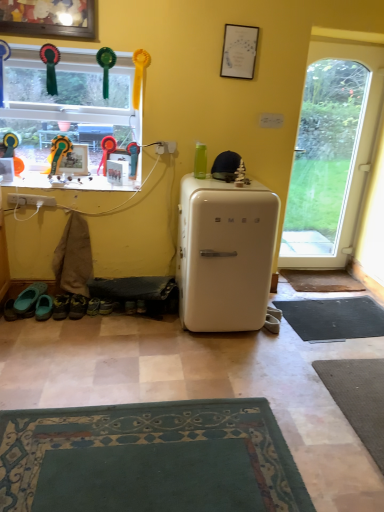
I want to click on empty space that is ontop of teal fabric shoes at lower left, arranged as the second footwear when viewed from the left (from a real-world perspective), so click(x=44, y=302).